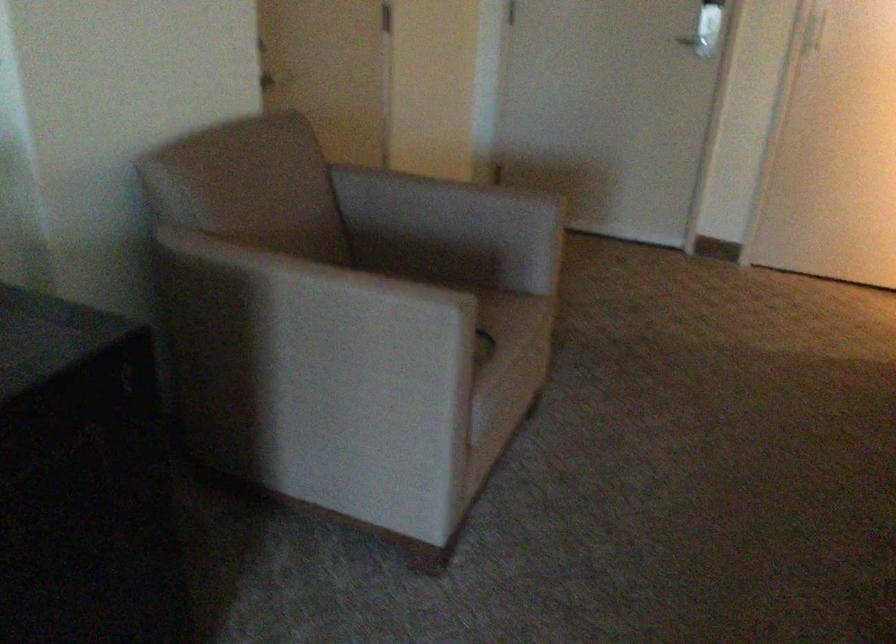
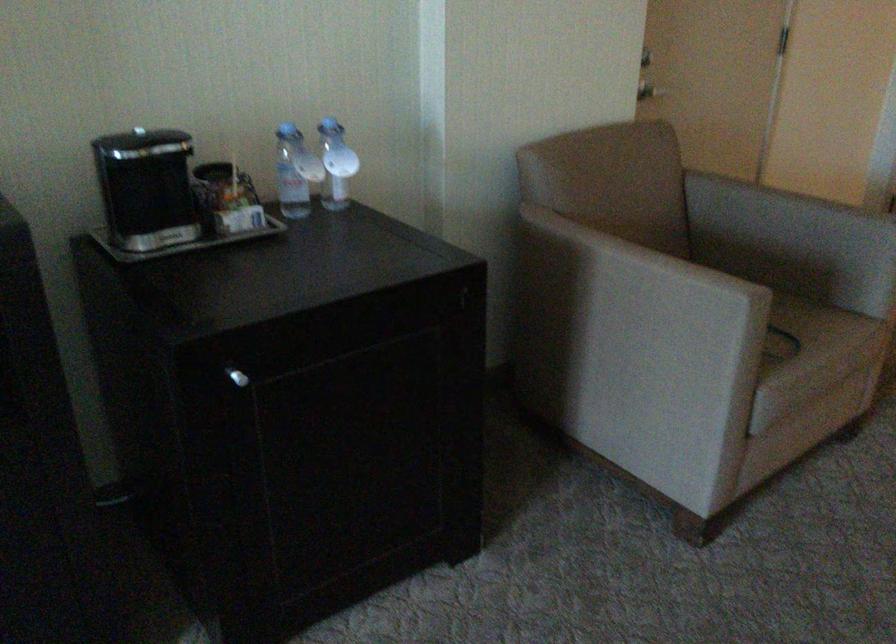
Find the pixel in the second image that matches (323,314) in the first image.

(631, 283)